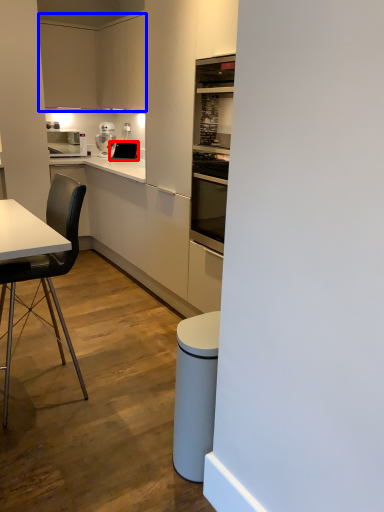
Question: Which point is further to the camera, appliance (highlighted by a red box) or cabinetry (highlighted by a blue box)?

Choices:
 (A) appliance
 (B) cabinetry

Answer: (A)